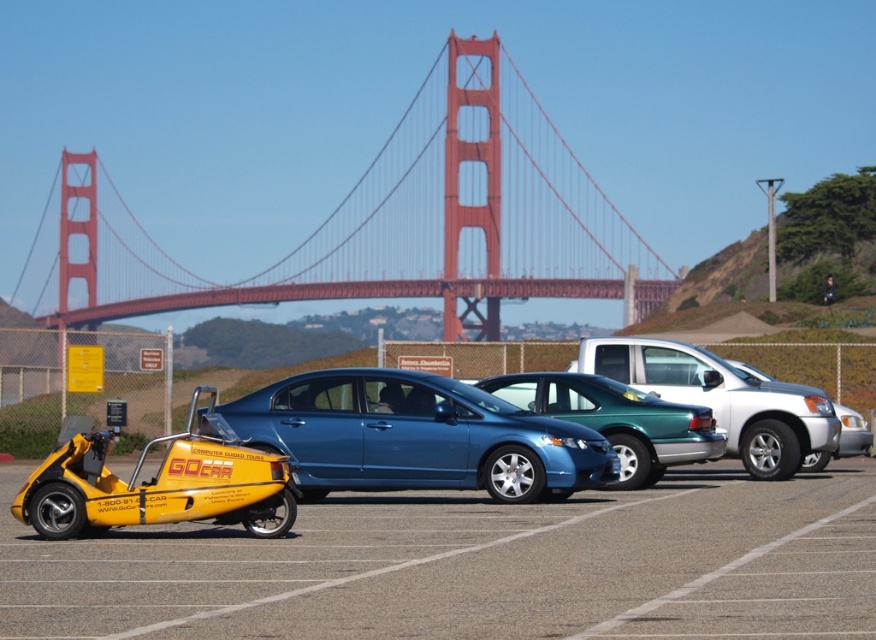
Question: Is yellow matte gocar at lower left positioned in front of metallic silver suv at center?

Choices:
 (A) no
 (B) yes

Answer: (B)

Question: Is yellow matte gocar at lower left to the right of blue metallic sedan at center from the viewer's perspective?

Choices:
 (A) no
 (B) yes

Answer: (A)

Question: Which point is closer to the camera?

Choices:
 (A) (511, 461)
 (B) (744, 401)

Answer: (A)

Question: Which is nearer to the blue metallic sedan at center?

Choices:
 (A) metallic silver suv at center
 (B) yellow matte gocar at lower left
 (C) metallic blue sedan at center

Answer: (A)

Question: Among these objects, which one is nearest to the camera?

Choices:
 (A) red metal bridge at center
 (B) metallic blue sedan at center
 (C) metallic silver suv at center

Answer: (B)

Question: Is red metal bridge at center above metallic silver suv at center?

Choices:
 (A) no
 (B) yes

Answer: (B)